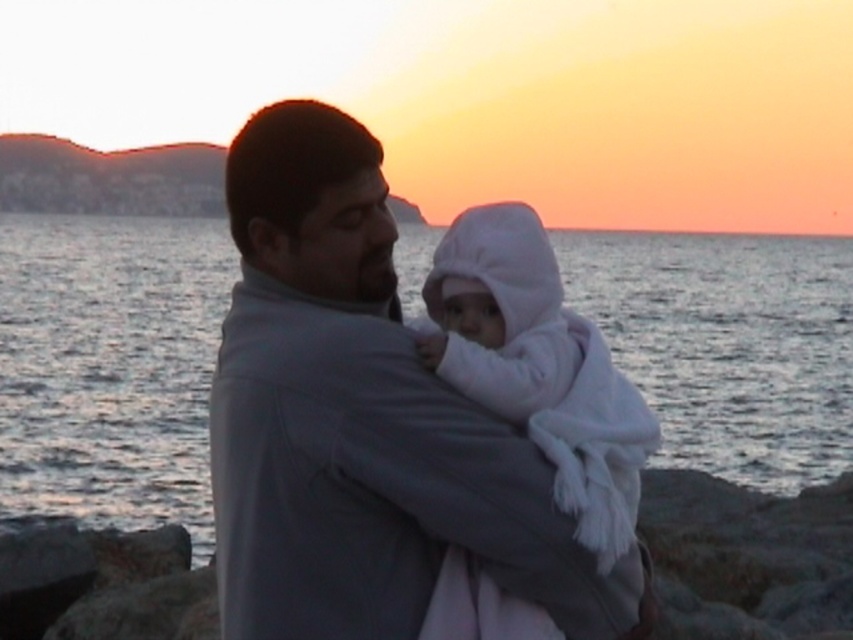
Based on the photo, you are a photographer trying to capture the sunset scene. You need to ensure that both the gray fabric jacket at center and the white fleece baby at center are clearly visible in your shot. Given their sizes, which object will appear larger in the photo?

The gray fabric jacket at center will appear larger in the photo since it has a greater height compared to the white fleece baby at center.

You are standing at the origin point in the image. There are two points marked in the scene. Which of the two points, point (664, 328) or point (277, 467), is farther away from you?

Point (664, 328) is farther away from you because it is behind point (277, 467).

You are a photographer trying to capture a closeup of the white fleece baby at center. The gray fabric jacket at center is blocking your view. Can you estimate if the jacket can be moved sideways to allow the camera to focus on the baby without moving the baby?

The gray fabric jacket at center is wider than the white fleece baby at center. Since the jacket is wider, moving it sideways might require more space to fully clear the baby, making it challenging to focus without adjusting the jacket more significantly.